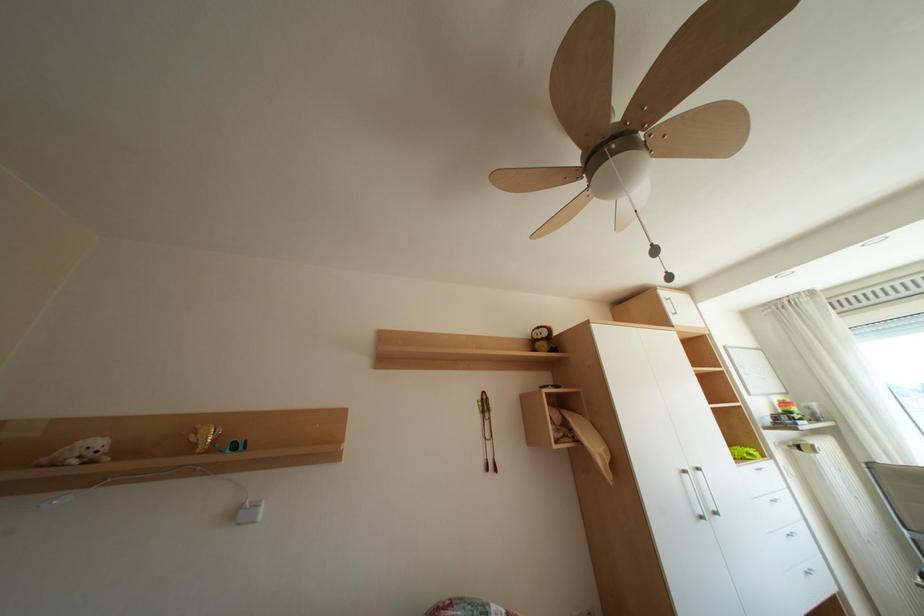
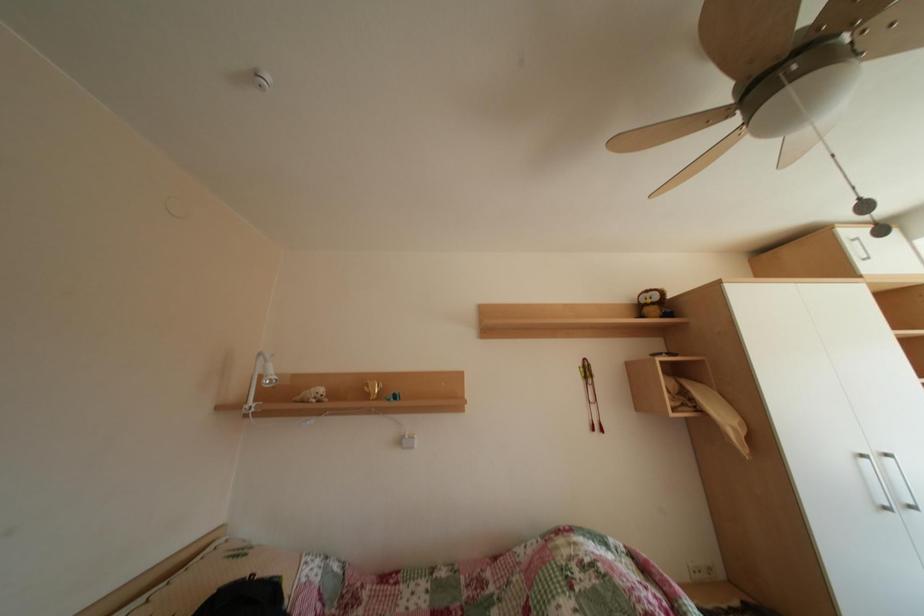
Question: The first image is from the beginning of the video and the second image is from the end. How did the camera likely rotate when shooting the video?

Choices:
 (A) Left
 (B) Right
 (C) Up
 (D) Down

Answer: (A)